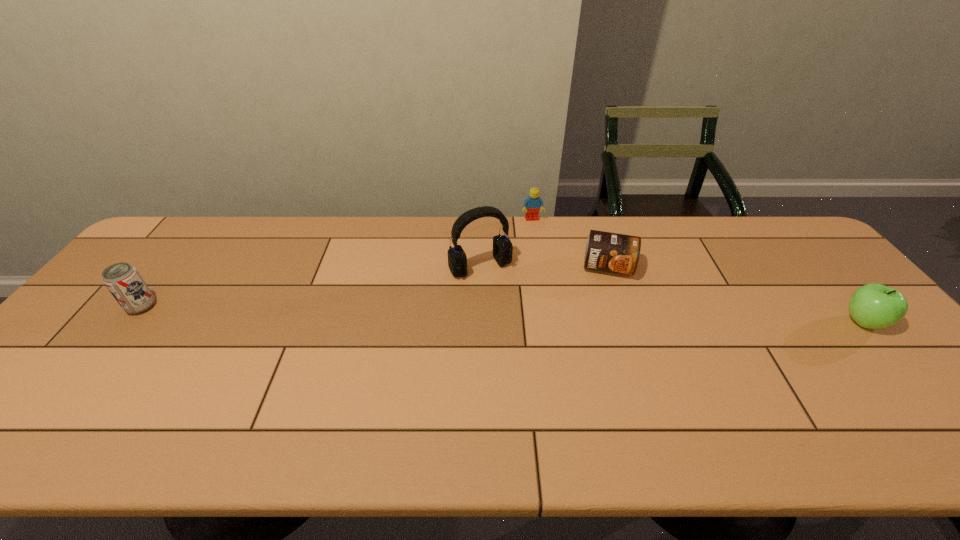
Point out which object is positioned as the nearest to the rightmost object. Please provide its 2D coordinates. Your answer should be formatted as a tuple, i.e. [(x, y)], where the tuple contains the x and y coordinates of a point satisfying the conditions above.

[(606, 251)]

You are a GUI agent. You are given a task and a screenshot of the screen. Output one action in this format:
    pyautogui.click(x=<x>, y=<y>)
    Task: Click on the vacant position in the image that satisfies the following two spatial constraints: 1. on the front side of the second object from right to left; 2. on the left side of the rightmost object
    
    Given the screenshot: What is the action you would take?
    pyautogui.click(x=626, y=322)

Locate an element on the screen. Image resolution: width=960 pixels, height=540 pixels. free location that satisfies the following two spatial constraints: 1. on the back side of the third object from left to right; 2. on the left side of the leftmost object is located at coordinates [210, 219].

You are a GUI agent. You are given a task and a screenshot of the screen. Output one action in this format:
    pyautogui.click(x=<x>, y=<y>)
    Task: Click on the free location that satisfies the following two spatial constraints: 1. on the front side of the farthest object; 2. on the right side of the fourth object from left to right
    The height and width of the screenshot is (540, 960).
    Given the screenshot: What is the action you would take?
    pyautogui.click(x=540, y=267)

Identify the location of vacant space that satisfies the following two spatial constraints: 1. on the front side of the headset; 2. on the right side of the apple. The width and height of the screenshot is (960, 540). (480, 322).